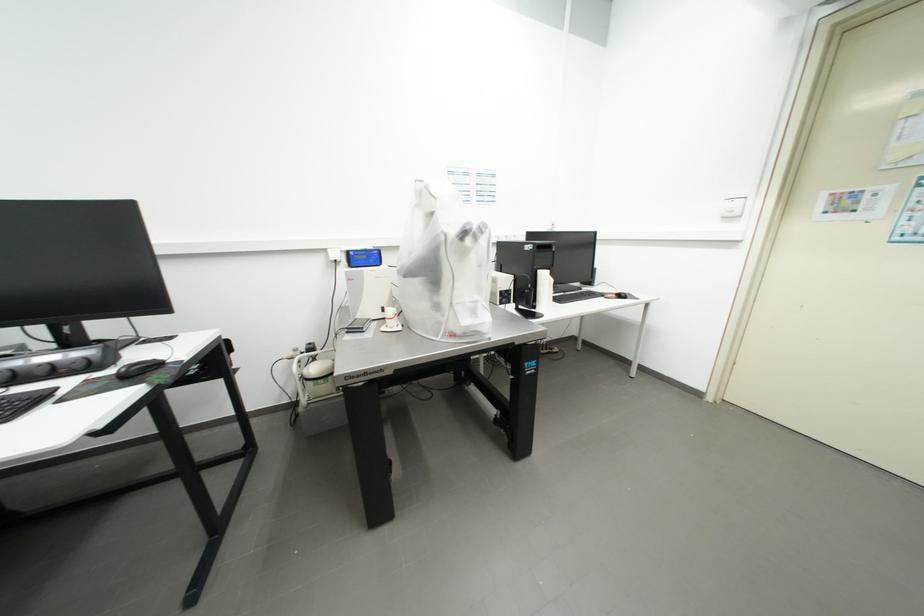
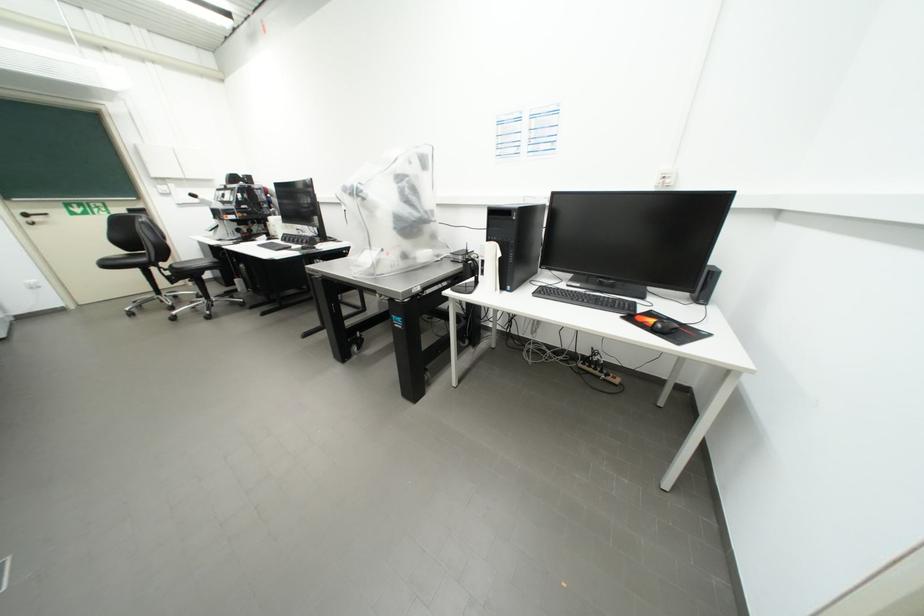
Find the pixel in the second image that matches point (553, 353) in the first image.

(603, 374)